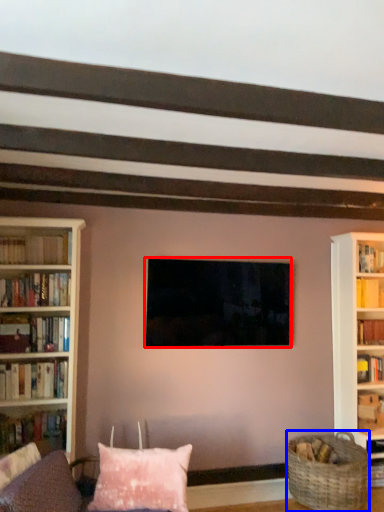
Question: Which object appears farthest to the camera in this image, television (highlighted by a red box) or basket (highlighted by a blue box)?

Choices:
 (A) television
 (B) basket

Answer: (A)